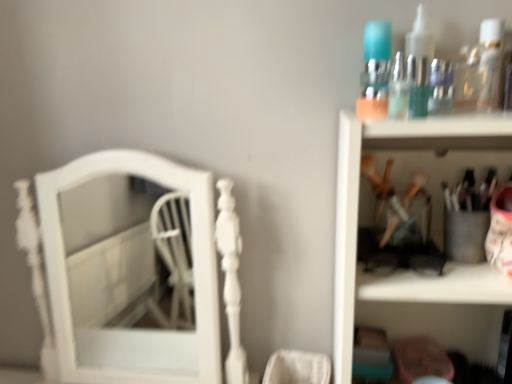
Question: Considering their positions, is white glossy mirror at left located in front of or behind clear plastic bottle at upper right?

Choices:
 (A) front
 (B) behind

Answer: (B)

Question: Would you say white glossy mirror at left is inside or outside clear plastic bottle at upper right?

Choices:
 (A) inside
 (B) outside

Answer: (B)

Question: Which is farther from the clear plastic bottle at upper right?

Choices:
 (A) white glossy mirror at left
 (B) translucent glass bottles at upper right
 (C) metallic silver utensils at upper right

Answer: (A)

Question: Based on their relative distances, which object is farther from the white glossy mirror at left?

Choices:
 (A) metallic silver utensils at upper right
 (B) clear plastic bottle at upper right
 (C) translucent glass bottles at upper right

Answer: (B)